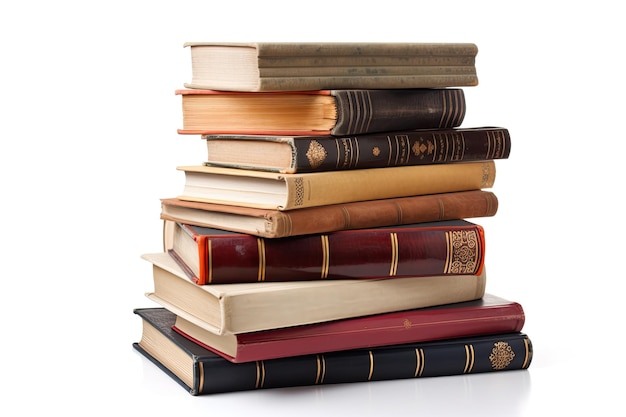
The image size is (626, 417). Identify the location of book. (238, 65), (254, 107), (258, 150), (250, 188), (244, 218), (191, 243), (182, 289), (211, 341), (176, 354).